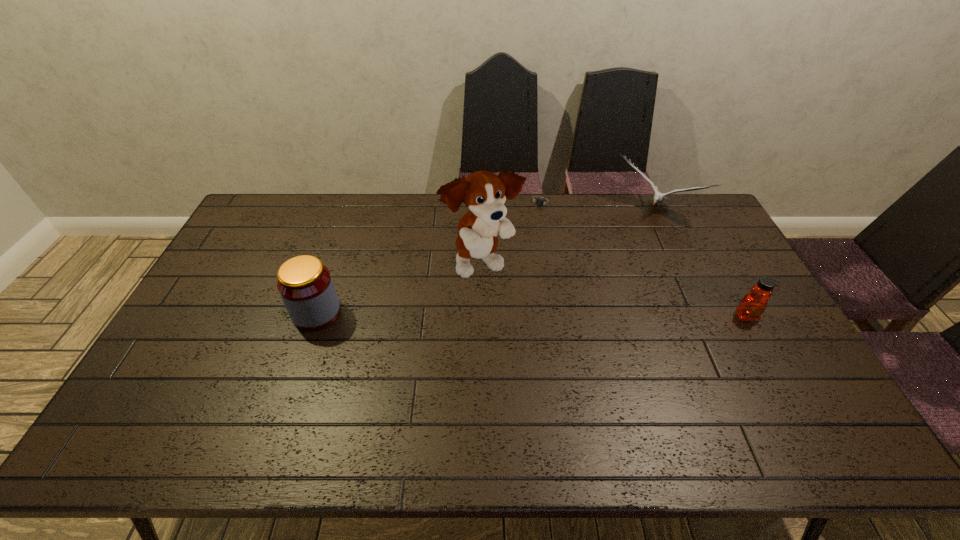
You are a GUI agent. You are given a task and a screenshot of the screen. Output one action in this format:
    pyautogui.click(x=<x>, y=<y>)
    Task: Click on the empty space that is in between the shortest object and the jar
    This screenshot has height=540, width=960.
    Given the screenshot: What is the action you would take?
    pyautogui.click(x=429, y=258)

Find the location of `unoccupied area between the second shortest object and the third object from left to right`. unoccupied area between the second shortest object and the third object from left to right is located at coordinates pyautogui.click(x=644, y=260).

Image resolution: width=960 pixels, height=540 pixels. What are the coordinates of `free space that is in between the watch and the second shortest object` in the screenshot? It's located at (644, 260).

I want to click on vacant point located between the second shortest object and the third object from left to right, so click(x=644, y=260).

The width and height of the screenshot is (960, 540). In order to click on vacant space in between the honey and the gull in this screenshot , I will do `click(700, 264)`.

Identify which object is the third nearest to the shortest object. Please provide its 2D coordinates. Your answer should be formatted as a tuple, i.e. [(x, y)], where the tuple contains the x and y coordinates of a point satisfying the conditions above.

[(752, 306)]

Locate which object ranks fourth in proximity to the shortest object. Please provide its 2D coordinates. Your answer should be formatted as a tuple, i.e. [(x, y)], where the tuple contains the x and y coordinates of a point satisfying the conditions above.

[(305, 285)]

Where is `free location that satisfies the following two spatial constraints: 1. on the front side of the watch; 2. on the left side of the gull`? free location that satisfies the following two spatial constraints: 1. on the front side of the watch; 2. on the left side of the gull is located at coordinates (543, 211).